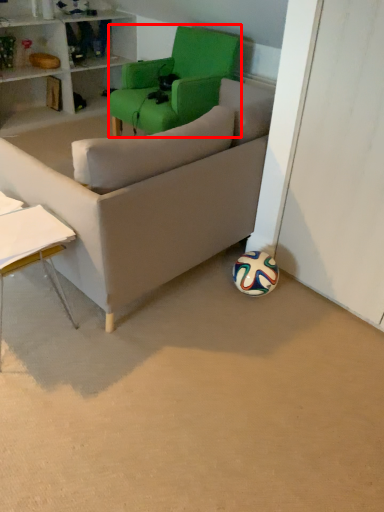
Question: From the image's perspective, where is chair (annotated by the red box) located in relation to table in the image?

Choices:
 (A) below
 (B) above

Answer: (B)